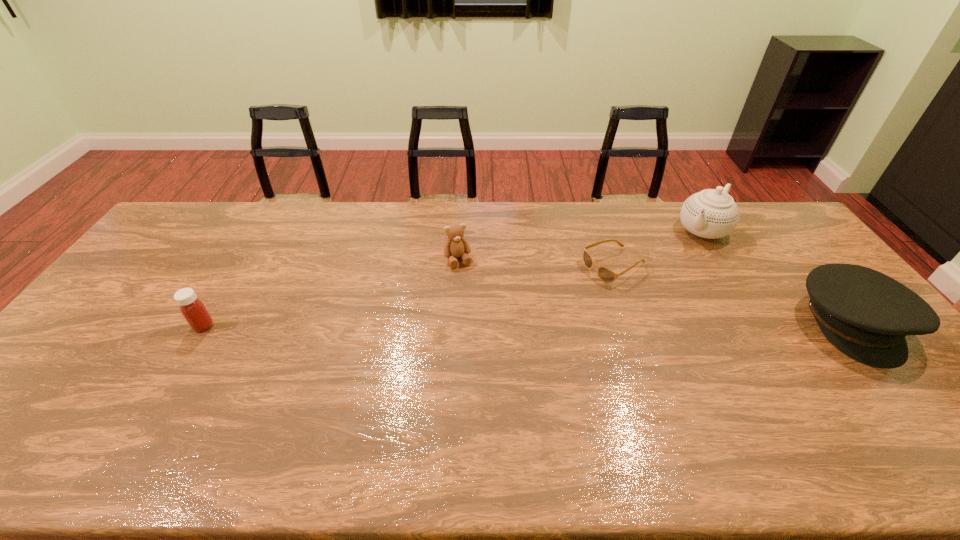
Find the location of `free location at the far edge of the desktop`. free location at the far edge of the desktop is located at coordinates (341, 221).

Find the location of `free spot at the near edge of the desktop`. free spot at the near edge of the desktop is located at coordinates (559, 394).

In the image, there is a desktop. In order to click on vacant area at the left edge in this screenshot , I will do `click(132, 315)`.

Locate an element on the screen. This screenshot has width=960, height=540. empty space between the chinaware and the second object from left to right is located at coordinates (580, 245).

At what (x,y) coordinates should I click in order to perform the action: click on unoccupied area between the medicine and the tallest object. Please return your answer as a coordinate pair (x, y). Looking at the image, I should click on (453, 278).

I want to click on empty space that is in between the shortest object and the medicine, so click(x=409, y=296).

You are a GUI agent. You are given a task and a screenshot of the screen. Output one action in this format:
    pyautogui.click(x=<x>, y=<y>)
    Task: Click on the free space between the farthest object and the teddy bear
    This screenshot has height=540, width=960.
    Given the screenshot: What is the action you would take?
    pyautogui.click(x=580, y=245)

The image size is (960, 540). I want to click on free spot between the leftmost object and the rightmost object, so click(x=527, y=325).

I want to click on empty location between the teddy bear and the chinaware, so click(x=580, y=245).

Where is `free space between the sunglasses and the teddy bear`? free space between the sunglasses and the teddy bear is located at coordinates (537, 263).